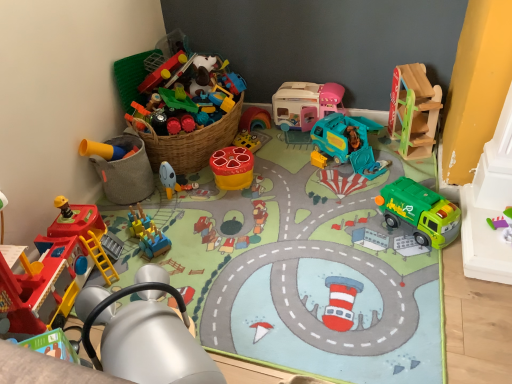
Identify the location of spots to the right of matte plastic stool at center, the fifth toy from the left. This screenshot has height=384, width=512. (279, 172).